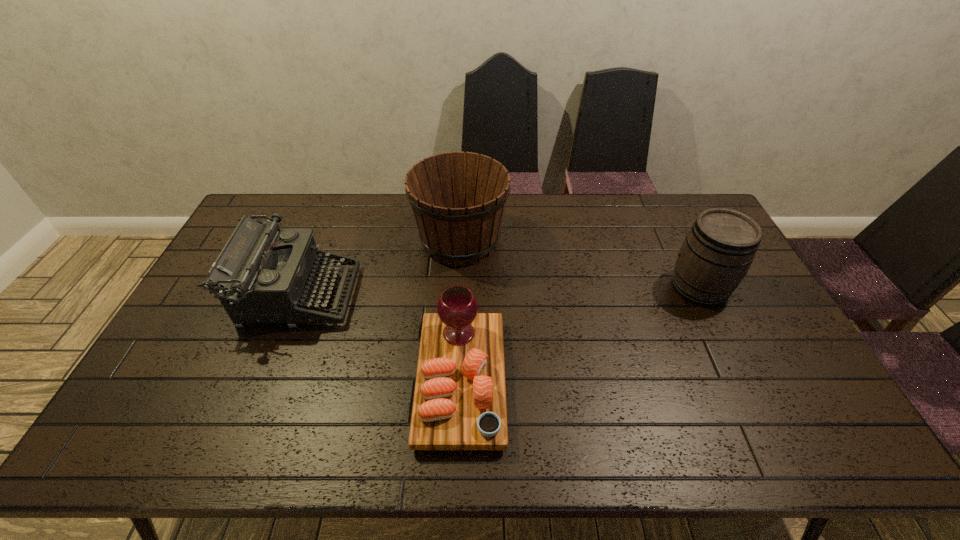
This screenshot has width=960, height=540. Find the location of `the left wine bucket`. the left wine bucket is located at coordinates (458, 199).

Image resolution: width=960 pixels, height=540 pixels. What are the coordinates of `the right wine bucket` in the screenshot? It's located at (720, 247).

Find the location of a particular element. typewriter is located at coordinates tap(265, 276).

At what (x,y) coordinates should I click in order to perform the action: click on platter. Please return your answer as a coordinate pair (x, y). Looking at the image, I should click on (459, 403).

Where is `vacant space located 0.120m on the front of the left wine bucket`? vacant space located 0.120m on the front of the left wine bucket is located at coordinates (457, 301).

Locate an element on the screen. This screenshot has width=960, height=540. blank space located 0.360m on the left of the right wine bucket is located at coordinates (553, 287).

I want to click on vacant space located on the typing side of the leftmost object, so click(390, 295).

Identify the location of blank space located 0.130m on the right of the platter. The image size is (960, 540). (555, 381).

Where is `object situated at the far edge`? Image resolution: width=960 pixels, height=540 pixels. object situated at the far edge is located at coordinates (458, 199).

At what (x,y) coordinates should I click in order to perform the action: click on object at the near edge. Please return your answer as a coordinate pair (x, y). The width and height of the screenshot is (960, 540). Looking at the image, I should click on tap(459, 403).